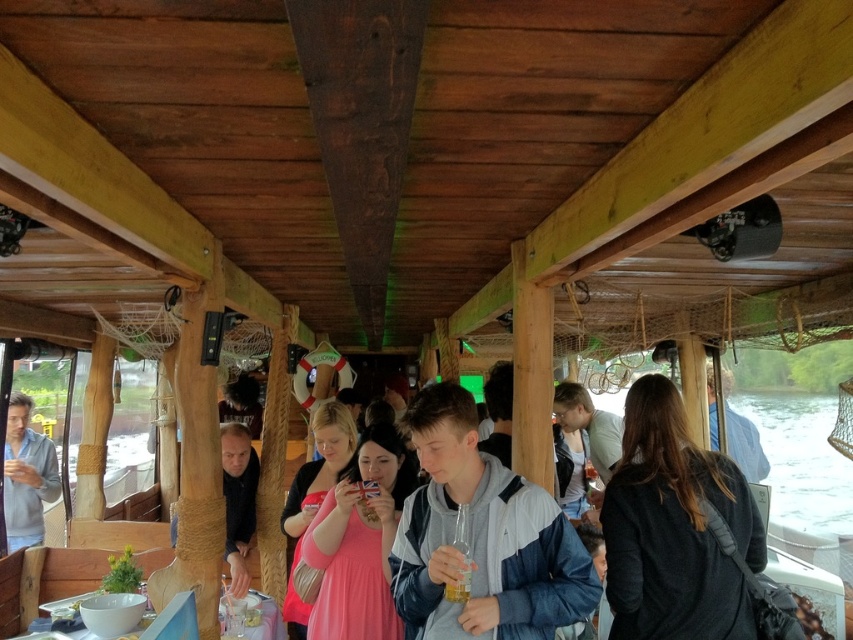
Question: Which point is farther from the camera taking this photo?

Choices:
 (A) (42, 493)
 (B) (450, 589)
 (C) (614, 568)

Answer: (A)

Question: Which object appears farthest from the camera in this image?

Choices:
 (A) blue fabric jacket at center
 (B) translucent plastic bottle at center
 (C) light blue fabric jacket at left

Answer: (C)

Question: Does blue fabric jacket at center appear on the left side of blue denim jacket at center?

Choices:
 (A) no
 (B) yes

Answer: (B)

Question: Among these points, which one is farthest from the camera?

Choices:
 (A) (445, 589)
 (B) (343, 454)

Answer: (B)

Question: Considering the relative positions of dark gray fabric jacket at center and light blue fabric jacket at left in the image provided, where is dark gray fabric jacket at center located with respect to light blue fabric jacket at left?

Choices:
 (A) below
 (B) above

Answer: (B)

Question: Is light blue fabric jacket at left positioned behind translucent plastic bottle at center?

Choices:
 (A) no
 (B) yes

Answer: (B)